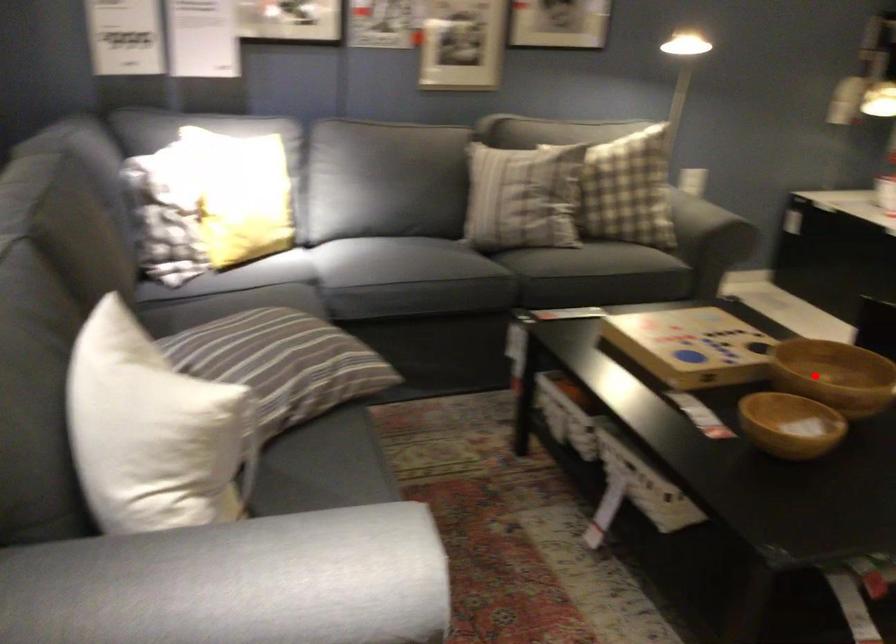
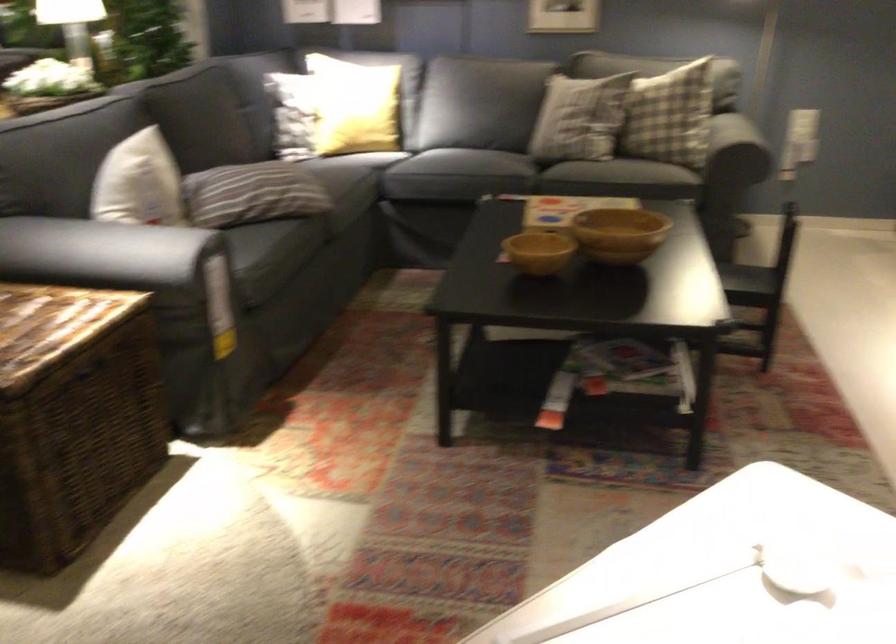
The point at the highlighted location is marked in the first image. Where is the corresponding point in the second image?

(618, 234)